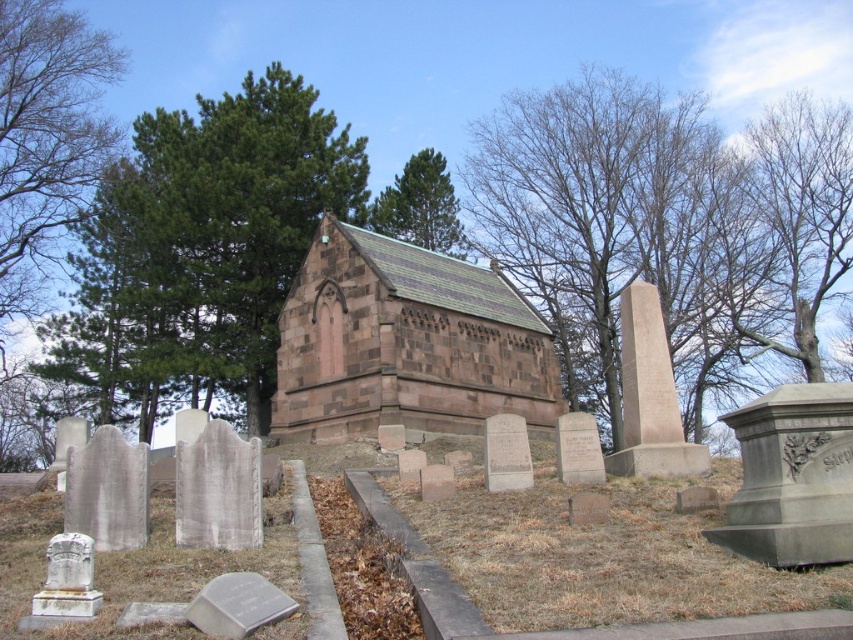
You are standing in the cemetery and want to take a photo of both the bare wood tree at upper center and the green leafy tree at upper center in the same frame. Which tree should you position closer to the left side of the camera to include both?

You should position the green leafy tree at upper center closer to the left side of the camera because the bare wood tree at upper center is to the right of it, ensuring both are in the frame.

You are a visitor standing at the entrance of the cemetery and want to take a photo of the small stone structure with the Gothic architectural style. Which tree, the green leafy tree at upper left or the green leafy tree at upper center, will appear closer to you in the photo?

The green leafy tree at upper left will appear closer to you in the photo because it is in front of the green leafy tree at upper center.